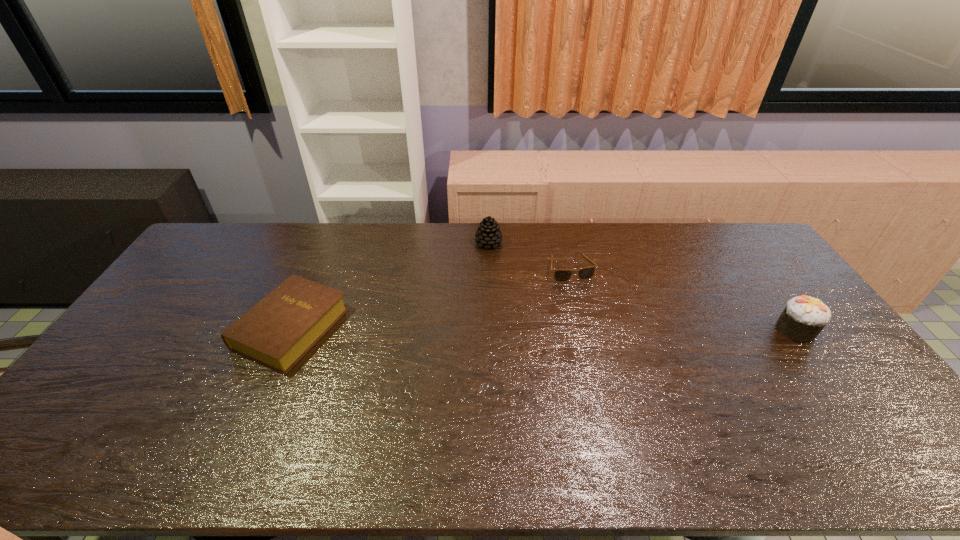
In the image, there is a desktop. Find the location of `vacant space at the left edge`. vacant space at the left edge is located at coordinates (181, 287).

The image size is (960, 540). In the image, there is a desktop. Find the location of `vacant region at the right edge`. vacant region at the right edge is located at coordinates (749, 284).

In the image, there is a desktop. What are the coordinates of `vacant space at the near left corner` in the screenshot? It's located at (96, 426).

Find the location of a particular element. The width and height of the screenshot is (960, 540). blank area at the far right corner is located at coordinates (736, 249).

Where is `free spot between the pinecone and the leftmost object`? Image resolution: width=960 pixels, height=540 pixels. free spot between the pinecone and the leftmost object is located at coordinates (390, 285).

The image size is (960, 540). In order to click on vacant space that's between the Bible and the cupcake in this screenshot , I will do `click(543, 328)`.

This screenshot has height=540, width=960. Find the location of `free spot between the farthest object and the leftmost object`. free spot between the farthest object and the leftmost object is located at coordinates (390, 285).

This screenshot has width=960, height=540. I want to click on blank region between the second object from left to right and the leftmost object, so click(390, 285).

Locate an element on the screen. free space between the second shortest object and the cupcake is located at coordinates (543, 328).

At what (x,y) coordinates should I click in order to perform the action: click on free space between the third object from left to right and the Bible. Please return your answer as a coordinate pair (x, y). The image size is (960, 540). Looking at the image, I should click on (431, 299).